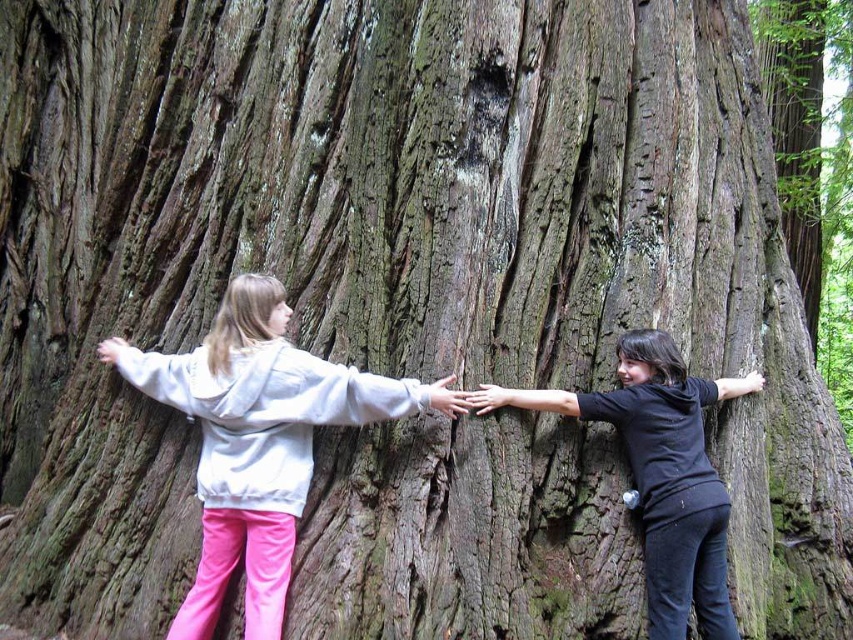
Question: Does light gray hoodie at center have a smaller size compared to black matte shirt at right?

Choices:
 (A) yes
 (B) no

Answer: (B)

Question: Does light gray hoodie at center appear on the right side of black matte shirt at right?

Choices:
 (A) no
 (B) yes

Answer: (A)

Question: Estimate the real-world distances between objects in this image. Which object is closer to the matte brown hand at center?

Choices:
 (A) light gray hoodie at center
 (B) smooth brown hand at center

Answer: (B)

Question: Which point is closer to the camera taking this photo?

Choices:
 (A) (225, 348)
 (B) (451, 380)
 (C) (498, 390)
 (D) (653, 424)

Answer: (A)

Question: Is light gray hoodie at center behind smooth brown hand at center?

Choices:
 (A) yes
 (B) no

Answer: (B)

Question: Estimate the real-world distances between objects in this image. Which object is farther from the matte brown hand at center?

Choices:
 (A) black matte shirt at right
 (B) light gray hoodie at center
 (C) smooth brown hand at center

Answer: (A)